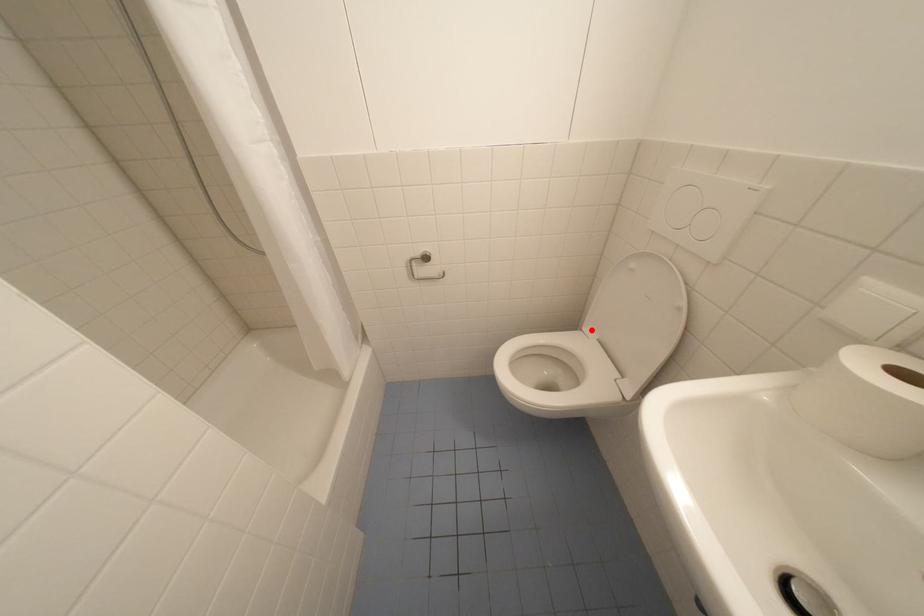
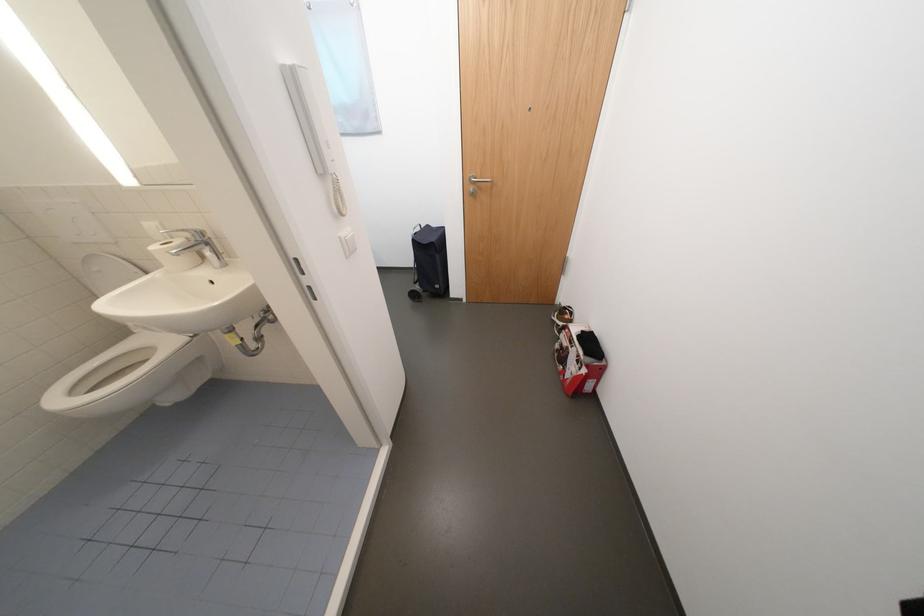
In the second image, find the point that corresponds to the highlighted location in the first image.

(142, 333)